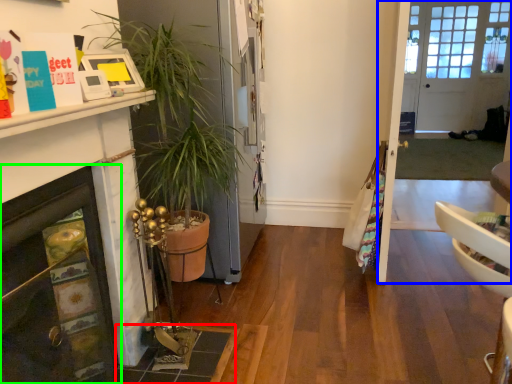
Question: Which object is the closest to the tile (highlighted by a red box)? Choose among these: glass door (highlighted by a blue box) or fireplace (highlighted by a green box).

Choices:
 (A) glass door
 (B) fireplace

Answer: (B)